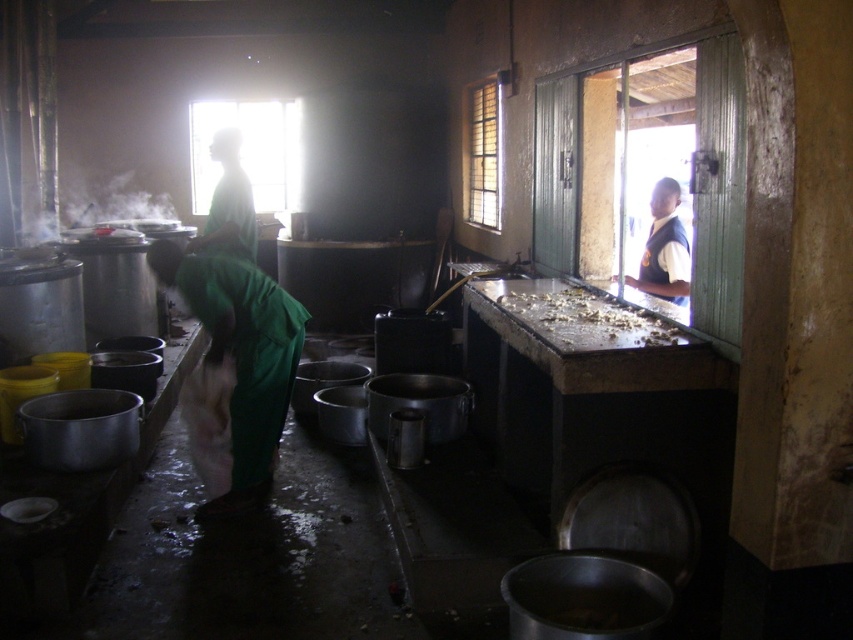
At what (x,y) coordinates should I click in order to perform the action: click on shiny metallic surface at right. Please return your answer as a coordinate pair (x, y). This screenshot has width=853, height=640. Looking at the image, I should click on (589, 321).

Is point (569, 294) more distant than point (648, 253)?

No, it is not.

In order to click on shiny metallic surface at right in this screenshot , I will do `click(589, 321)`.

Does shiny metallic surface at right have a smaller size compared to green fabric at center?

Yes, shiny metallic surface at right is smaller than green fabric at center.

Can you confirm if shiny metallic surface at right is positioned above green fabric at center?

Incorrect, shiny metallic surface at right is not positioned above green fabric at center.

Find the location of a particular element. This screenshot has width=853, height=640. shiny metallic surface at right is located at coordinates (589, 321).

Locate an element on the screen. green fabric at center is located at coordinates pyautogui.click(x=229, y=202).

Is point (235, 228) closer to camera compared to point (665, 236)?

Yes, point (235, 228) is closer to viewer.

I want to click on green fabric at center, so click(x=229, y=202).

Image resolution: width=853 pixels, height=640 pixels. I want to click on green fabric at center, so click(229, 202).